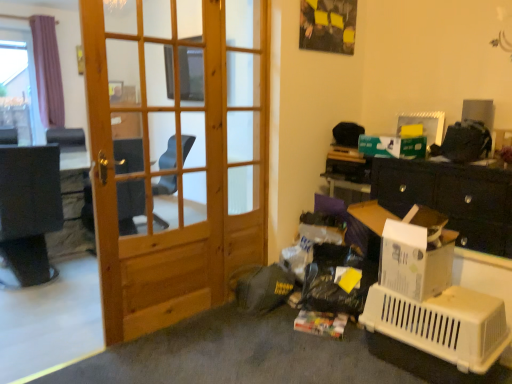
Question: Is wooden screen door at center not near natural wood door at center?

Choices:
 (A) yes
 (B) no

Answer: (B)

Question: From a real-world perspective, is wooden screen door at center over natural wood door at center?

Choices:
 (A) no
 (B) yes

Answer: (B)

Question: From the image's perspective, would you say wooden screen door at center is shown under natural wood door at center?

Choices:
 (A) yes
 (B) no

Answer: (B)

Question: Are wooden screen door at center and natural wood door at center beside each other?

Choices:
 (A) yes
 (B) no

Answer: (B)

Question: Considering the relative sizes of wooden screen door at center and natural wood door at center in the image provided, is wooden screen door at center taller than natural wood door at center?

Choices:
 (A) no
 (B) yes

Answer: (B)

Question: Is wooden screen door at center positioned beyond the bounds of natural wood door at center?

Choices:
 (A) yes
 (B) no

Answer: (A)

Question: From the image's perspective, is white plastic pet carrier at lower right under wooden screen door at center?

Choices:
 (A) yes
 (B) no

Answer: (A)

Question: From a real-world perspective, is white plastic pet carrier at lower right located beneath wooden screen door at center?

Choices:
 (A) no
 (B) yes

Answer: (B)

Question: Are white plastic pet carrier at lower right and wooden screen door at center far apart?

Choices:
 (A) yes
 (B) no

Answer: (A)

Question: Can you see white plastic pet carrier at lower right touching wooden screen door at center?

Choices:
 (A) no
 (B) yes

Answer: (A)

Question: Is white plastic pet carrier at lower right oriented towards wooden screen door at center?

Choices:
 (A) no
 (B) yes

Answer: (A)

Question: Considering the relative sizes of white plastic pet carrier at lower right and wooden screen door at center in the image provided, is white plastic pet carrier at lower right bigger than wooden screen door at center?

Choices:
 (A) yes
 (B) no

Answer: (A)

Question: Is natural wood door at center at the right side of white plastic pet carrier at lower right?

Choices:
 (A) yes
 (B) no

Answer: (B)